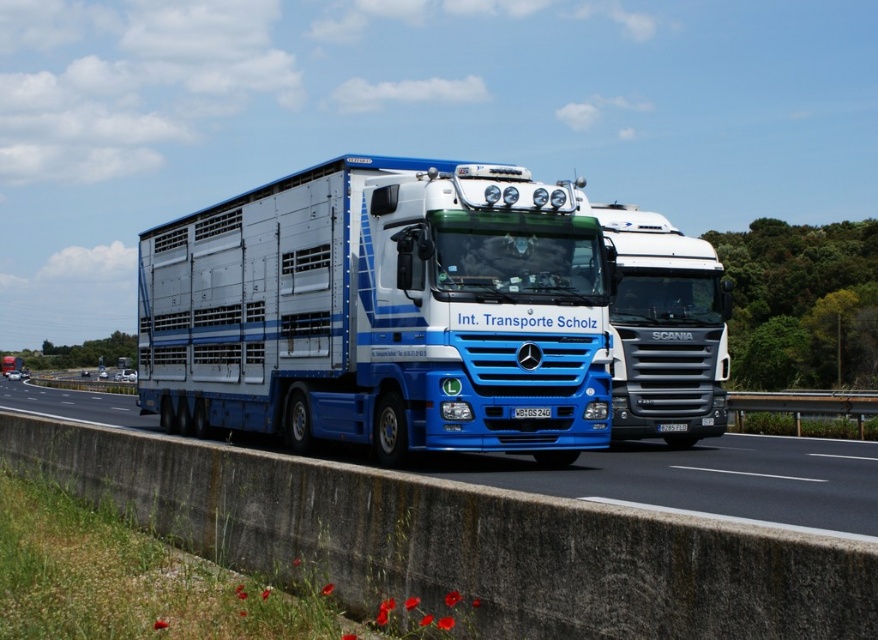
You are a delivery driver who needs to know if your truck can pass under a bridge that has a height restriction of 4 meters. You observe the blue glossy truck at center and the blue plastic license plate at center in the image. Can you determine if the truck is taller than the license plate?

The blue glossy truck at center has a greater height compared to the blue plastic license plate at center, so yes, the truck is taller than the license plate.